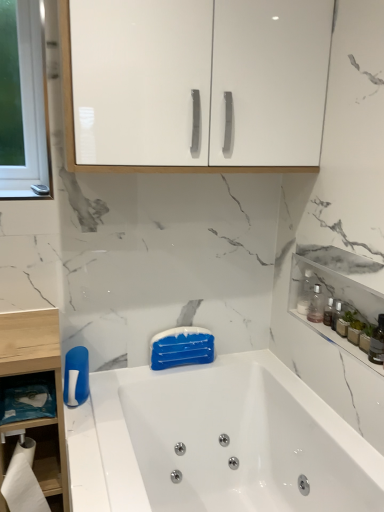
Question: Would you say translucent glass bottle at right is to the left or to the right of clear plastic bottle at upper right in the picture?

Choices:
 (A) left
 (B) right

Answer: (B)

Question: Considering their positions, is translucent glass bottle at right located in front of or behind clear plastic bottle at upper right?

Choices:
 (A) behind
 (B) front

Answer: (B)

Question: Which object is positioned closest to the clear plastic bottle at upper right?

Choices:
 (A) translucent glass bottle at right
 (B) white glossy cabinet at upper center, arranged as the first cabinetry when viewed from the left
 (C) white paper at lower left
 (D) white glossy bathtub at center
 (E) translucent glass bottles at upper right, the 1th cabinetry in the right-to-left sequence

Answer: (E)

Question: Which of these objects is positioned closest to the translucent glass bottle at right?

Choices:
 (A) white glossy cabinet at upper center, arranged as the first cabinetry when viewed from the left
 (B) white glossy bathtub at center
 (C) translucent glass bottles at upper right, arranged as the second cabinetry when viewed from the top
 (D) white paper at lower left
 (E) transparent plastic bottle at right

Answer: (C)